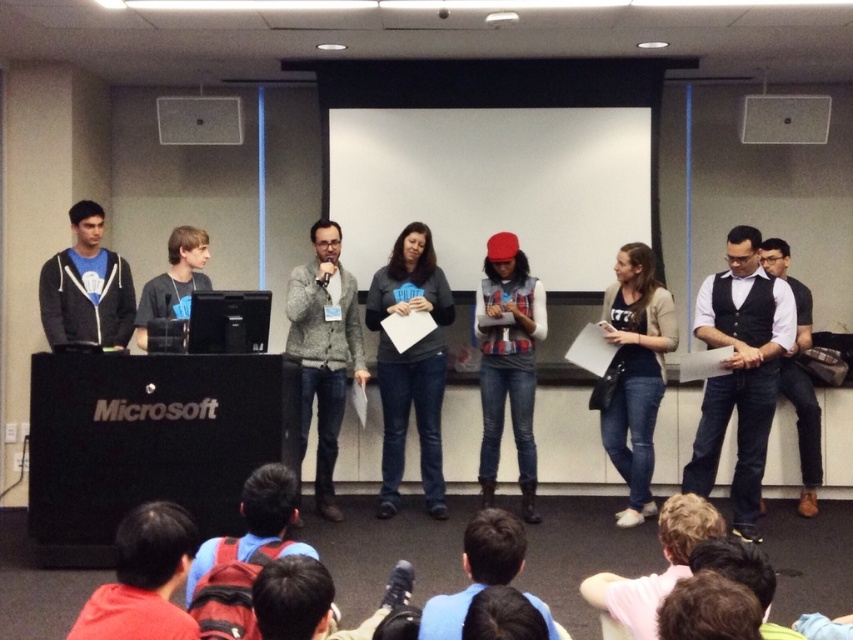
Question: Can you confirm if denim vest at center is positioned above blue denim jeans at lower center?

Choices:
 (A) no
 (B) yes

Answer: (B)

Question: Does matte black hoodie at left have a lesser width compared to matte black laptop at upper center?

Choices:
 (A) no
 (B) yes

Answer: (B)

Question: Which point is farther from the camera taking this photo?

Choices:
 (A) (654, 349)
 (B) (744, 125)
 (C) (503, 364)

Answer: (B)

Question: Which object appears closest to the camera in this image?

Choices:
 (A) matte black hoodie at left
 (B) matte black laptop at upper center
 (C) denim vest at center

Answer: (A)

Question: Estimate the real-world distances between objects in this image. Which object is closer to the knitted sweater at center?

Choices:
 (A) black matte projector at upper center
 (B) white matte vest at center
 (C) denim jeans at center
 (D) matte black laptop at upper center

Answer: (A)

Question: Is white matte projection screen at center bigger than knitted sweater at center?

Choices:
 (A) no
 (B) yes

Answer: (A)